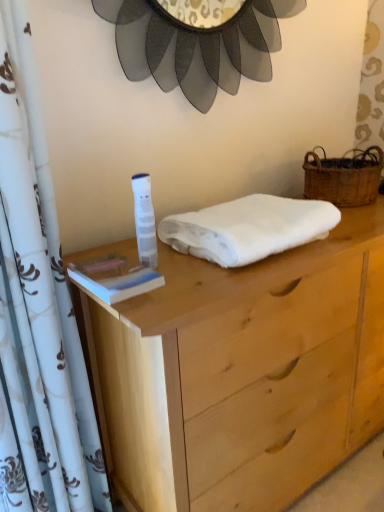
The image size is (384, 512). Describe the element at coordinates (242, 373) in the screenshot. I see `natural wood chest of drawers at center` at that location.

Measure the distance between point (31, 129) and camera.

Point (31, 129) is 34.45 inches away from camera.

Image resolution: width=384 pixels, height=512 pixels. Describe the element at coordinates (38, 311) in the screenshot. I see `white floral fabric curtain at left` at that location.

At what (x,y) coordinates should I click in order to perform the action: click on natural wood chest of drawers at center. Please return your answer as a coordinate pair (x, y). This screenshot has width=384, height=512. Looking at the image, I should click on (242, 373).

This screenshot has width=384, height=512. I want to click on toiletry above the white soft towel at center (from a real-world perspective), so click(x=144, y=220).

From the image's perspective, would you say white soft towel at center is shown under white plastic tube at center?

No.

Considering the positions of point (300, 238) and point (141, 247), is point (300, 238) closer or farther from the camera than point (141, 247)?

Clearly, point (300, 238) is more distant from the camera than point (141, 247).

From the image's perspective, between white soft towel at center and brown woven picnic basket at right, who is located below?

white soft towel at center, from the image's perspective.

Is white soft towel at center far from brown woven picnic basket at right?

No, white soft towel at center is in close proximity to brown woven picnic basket at right.

Is white soft towel at center oriented towards brown woven picnic basket at right?

No.

Considering their positions, is brown woven picnic basket at right located in front of or behind white soft towel at center?

brown woven picnic basket at right is behind white soft towel at center.

How far apart are brown woven picnic basket at right and white soft towel at center?

A distance of 16.29 inches exists between brown woven picnic basket at right and white soft towel at center.

Which is less distant, (x=357, y=178) or (x=273, y=201)?

The point (x=273, y=201) is closer to the camera.

In the image, is white plastic tube at center positioned in front of or behind white soft towel at center?

Clearly, white plastic tube at center is behind white soft towel at center.

Which object is positioned more to the left, white plastic tube at center or white soft towel at center?

Positioned to the left is white plastic tube at center.

Which point is more distant from viewer, [138,179] or [271,226]?

The point [271,226] is farther.

Can you confirm if white plastic tube at center is smaller than white soft towel at center?

Yes, white plastic tube at center is smaller than white soft towel at center.

From the image's perspective, which object appears higher, white soft towel at center or white floral fabric curtain at left?

white soft towel at center.

Which is behind, white soft towel at center or white floral fabric curtain at left?

white soft towel at center.

Considering the relative sizes of white soft towel at center and white floral fabric curtain at left in the image provided, is white soft towel at center bigger than white floral fabric curtain at left?

Incorrect, white soft towel at center is not larger than white floral fabric curtain at left.

Considering the relative sizes of white soft towel at center and white floral fabric curtain at left in the image provided, is white soft towel at center wider than white floral fabric curtain at left?

Yes.

Does white floral fabric curtain at left come in front of brown woven picnic basket at right?

Yes, white floral fabric curtain at left is in front of brown woven picnic basket at right.

Would you say white floral fabric curtain at left is outside brown woven picnic basket at right?

Yes, white floral fabric curtain at left is located beyond the bounds of brown woven picnic basket at right.

From the image's perspective, which one is positioned higher, white floral fabric curtain at left or brown woven picnic basket at right?

brown woven picnic basket at right appears higher in the image.

Is white floral fabric curtain at left bigger than brown woven picnic basket at right?

Yes.

Is brown woven picnic basket at right facing away from white floral fabric curtain at left?

brown woven picnic basket at right does not have its back to white floral fabric curtain at left.

Locate an element on the screen. This screenshot has width=384, height=512. curtain in front of the brown woven picnic basket at right is located at coordinates (38, 311).

Does point (368, 148) come farther from viewer compared to point (36, 426)?

Yes, it is behind point (36, 426).

Between brown woven picnic basket at right and white floral fabric curtain at left, which one has more height?

white floral fabric curtain at left.

Identify the location of towel in front of the white plastic tube at center. The width and height of the screenshot is (384, 512). (248, 228).

The image size is (384, 512). Identify the location of towel on the left of brown woven picnic basket at right. (248, 228).

From the image, which object appears to be farther from brown woven picnic basket at right, white floral fabric curtain at left or natural wood chest of drawers at center?

white floral fabric curtain at left lies further to brown woven picnic basket at right than the other object.

Looking at this image, considering their positions, is white plastic tube at center positioned closer to white floral fabric curtain at left than white soft towel at center?

Among the two, white plastic tube at center is located nearer to white floral fabric curtain at left.

Based on their spatial positions, is natural wood chest of drawers at center or brown woven picnic basket at right closer to white floral fabric curtain at left?

natural wood chest of drawers at center lies closer to white floral fabric curtain at left than the other object.

Considering their positions, is white soft towel at center positioned further to natural wood chest of drawers at center than brown woven picnic basket at right?

brown woven picnic basket at right is positioned further to the anchor natural wood chest of drawers at center.

Looking at the image, which one is located further to white soft towel at center, brown woven picnic basket at right or white plastic tube at center?

brown woven picnic basket at right is positioned further to the anchor white soft towel at center.

Looking at the image, which one is located further to natural wood chest of drawers at center, white soft towel at center or white floral fabric curtain at left?

white floral fabric curtain at left.

When comparing their distances from white floral fabric curtain at left, does brown woven picnic basket at right or white plastic tube at center seem further?

brown woven picnic basket at right is further to white floral fabric curtain at left.

Considering their positions, is white soft towel at center positioned closer to white floral fabric curtain at left than brown woven picnic basket at right?

white soft towel at center is positioned closer to the anchor white floral fabric curtain at left.

This screenshot has height=512, width=384. Identify the location of chest of drawers between white floral fabric curtain at left and brown woven picnic basket at right. [242, 373].

Locate an element on the screen. towel between white plastic tube at center and brown woven picnic basket at right in the horizontal direction is located at coordinates (248, 228).

Locate an element on the screen. Image resolution: width=384 pixels, height=512 pixels. towel between white floral fabric curtain at left and brown woven picnic basket at right from left to right is located at coordinates [248, 228].

At what (x,y) coordinates should I click in order to perform the action: click on towel between brown woven picnic basket at right and natural wood chest of drawers at center in the vertical direction. Please return your answer as a coordinate pair (x, y). This screenshot has height=512, width=384. Looking at the image, I should click on (248, 228).